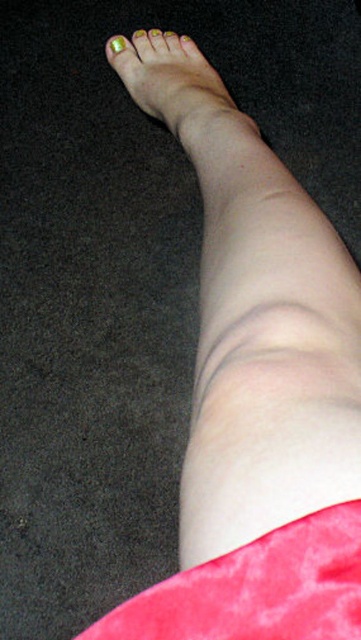
Question: Which object is the closest to the gold metallic nail at upper left?

Choices:
 (A) pink velvety fabric at lower right
 (B) green matte nail polish at upper left
 (C) smooth skin leg at center

Answer: (B)

Question: Is green matte nail polish at upper left closer to camera compared to gold metallic nail at upper left?

Choices:
 (A) yes
 (B) no

Answer: (A)

Question: Can you confirm if green matte nail polish at upper left is wider than yellow matte nail at center?

Choices:
 (A) no
 (B) yes

Answer: (B)

Question: Which point appears farthest from the camera in this image?

Choices:
 (A) (164, 33)
 (B) (296, 624)

Answer: (A)

Question: Can you confirm if metallic gold nail polish at center is smaller than gold metallic nail at upper left?

Choices:
 (A) yes
 (B) no

Answer: (B)

Question: Which of the following is the farthest from the observer?

Choices:
 (A) (158, 35)
 (B) (175, 33)
 (C) (133, 35)
 (D) (159, 102)

Answer: (B)